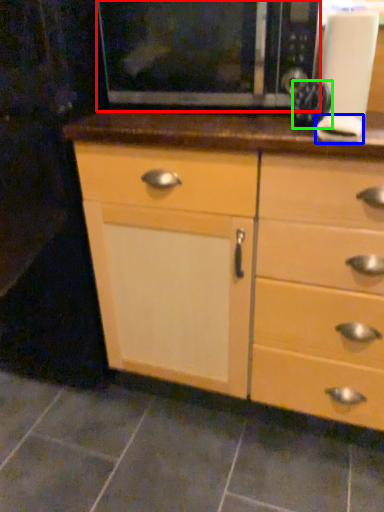
Question: Which object is the closest to the microwave (highlighted by a red box)? Choose among these: knob (highlighted by a blue box) or appliance (highlighted by a green box).

Choices:
 (A) knob
 (B) appliance

Answer: (B)